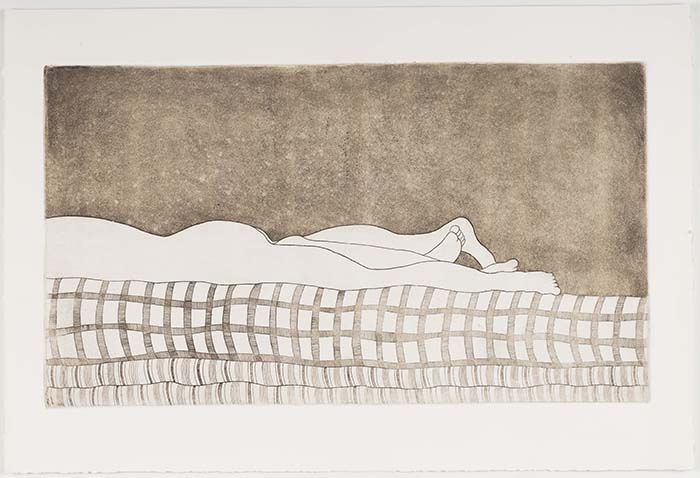
Image resolution: width=700 pixels, height=478 pixels. In order to click on dark spots in upper corners in this screenshot , I will do `click(74, 88)`, `click(631, 82)`.